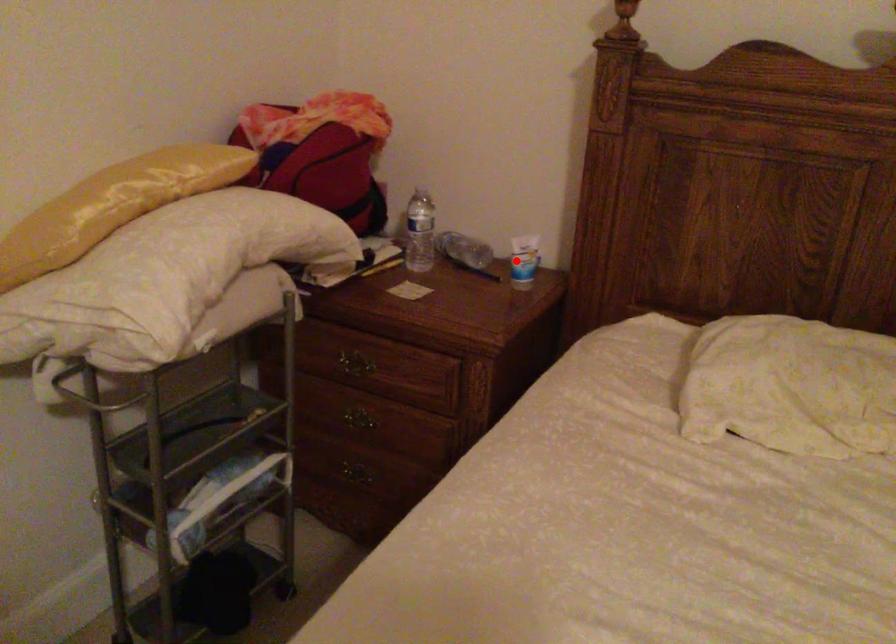
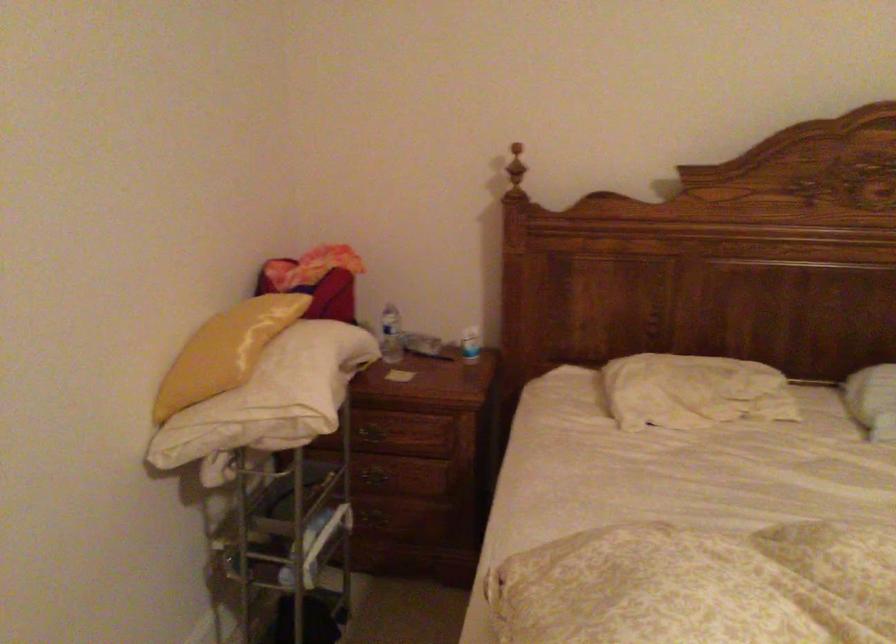
Question: I am providing you with two images of the same scene from different viewpoints. In image1, a red point is highlighted. Considering the same 3D point in image2, which of the following is correct?

Choices:
 (A) It is closer
 (B) It is farther

Answer: (B)